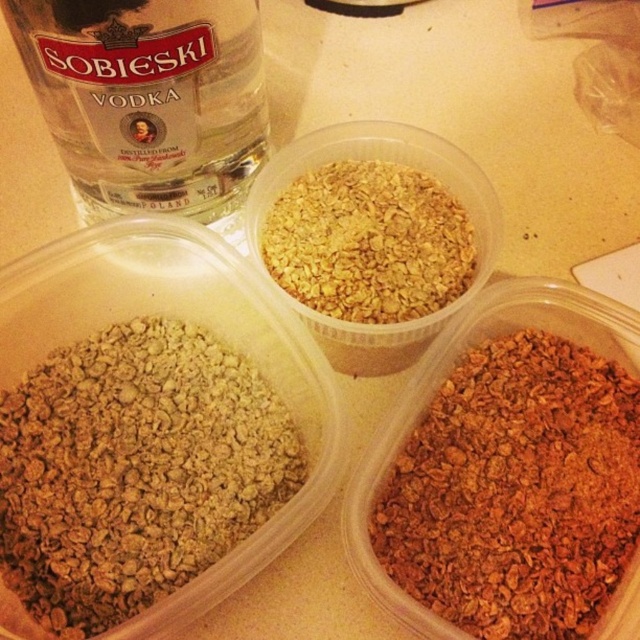
Is matte glass bottle at upper left bigger than golden granular cereal at center?

Yes.

Can you confirm if matte glass bottle at upper left is positioned to the right of golden granular cereal at center?

No, matte glass bottle at upper left is not to the right of golden granular cereal at center.

Is point (76, 3) closer to viewer compared to point (396, 285)?

Yes, it is.

The height and width of the screenshot is (640, 640). I want to click on matte glass bottle at upper left, so (148, 99).

Does brown crunchy granola at lower right appear under matte glass bottle at upper left?

Yes.

Is brown crunchy granola at lower right behind matte glass bottle at upper left?

That is True.

Measure the distance between brown crunchy granola at lower right and camera.

The distance of brown crunchy granola at lower right from camera is 68.09 centimeters.

This screenshot has height=640, width=640. I want to click on brown crunchy granola at lower right, so click(x=516, y=490).

Between point (83, 582) and point (51, 90), which one is positioned behind?

The point (51, 90) is behind.

Is brown granular cereal at lower left bigger than matte glass bottle at upper left?

Yes.

Is point (138, 445) closer to viewer compared to point (88, 42)?

That is False.

I want to click on brown granular cereal at lower left, so click(x=134, y=470).